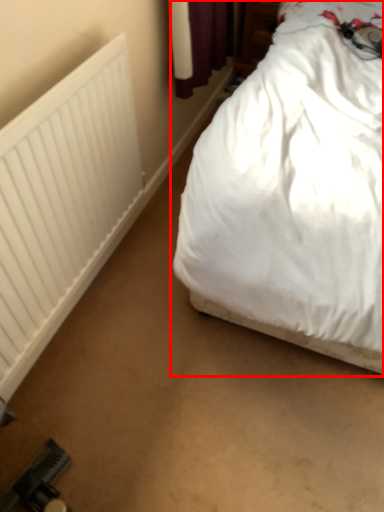
Question: Where is bed (annotated by the red box) located in relation to radiator in the image?

Choices:
 (A) left
 (B) right

Answer: (B)